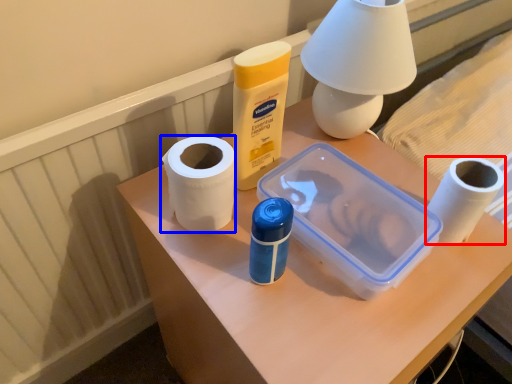
Question: Which of the following is the farthest to the observer, toilet paper (highlighted by a red box) or paper towel (highlighted by a blue box)?

Choices:
 (A) toilet paper
 (B) paper towel

Answer: (A)